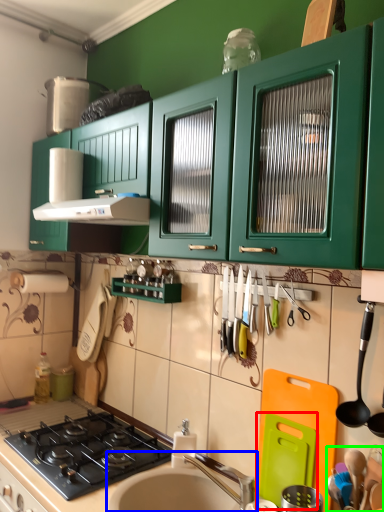
Question: Which object is positioned farthest from appliance (highlighted by a red box)? Select from sink (highlighted by a blue box) and appliance (highlighted by a green box).

Choices:
 (A) sink
 (B) appliance

Answer: (A)